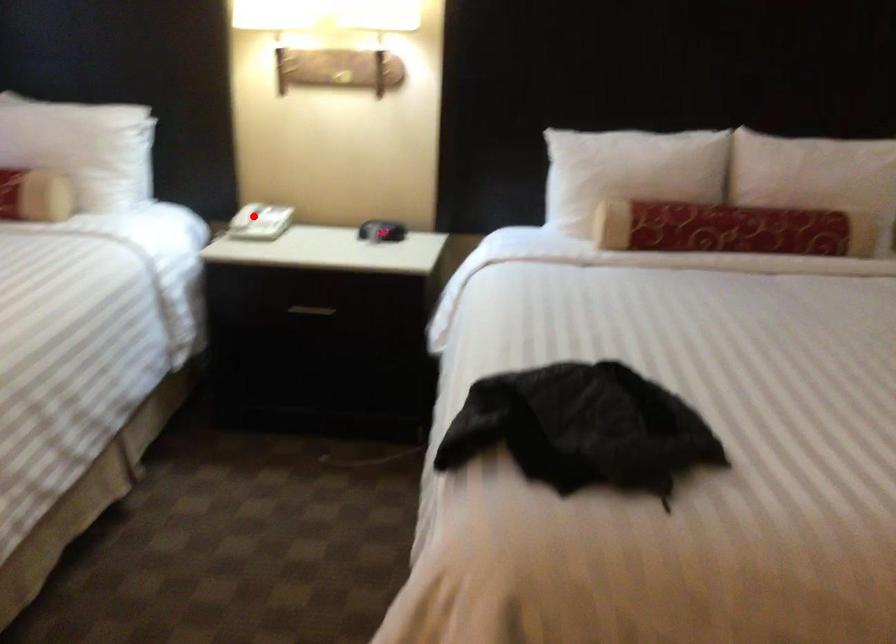
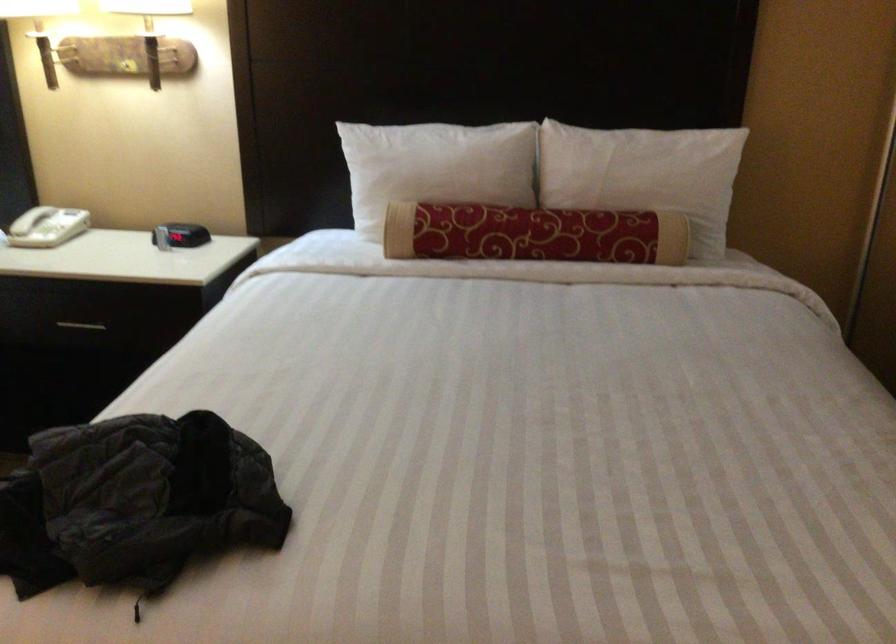
Question: I am providing you with two images of the same scene from different viewpoints. Image1 has a red point marked. In image2, the corresponding 3D location appears at what relative position? Reply with the corresponding letter.

Choices:
 (A) Closer
 (B) Farther

Answer: (A)